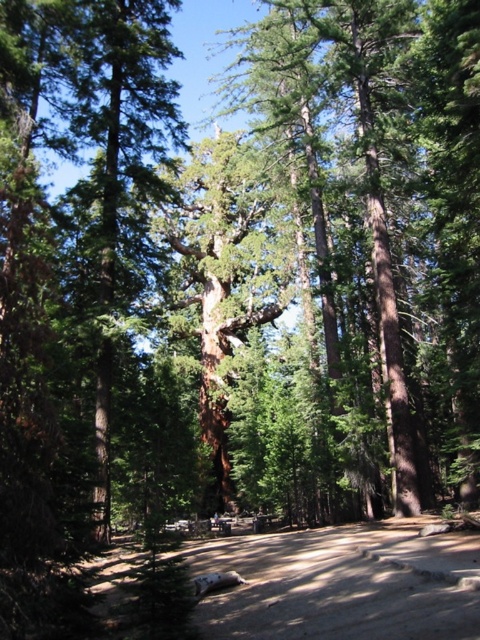
Question: Can you confirm if brown sandy dirt track at lower center is bigger than green rough bark tree at center?

Choices:
 (A) yes
 (B) no

Answer: (B)

Question: Does brown sandy dirt track at lower center appear under green rough bark tree at center?

Choices:
 (A) no
 (B) yes

Answer: (B)

Question: Which point appears closest to the camera in this image?

Choices:
 (A) pos(437,621)
 (B) pos(228,204)

Answer: (A)

Question: Which point is farther to the camera?

Choices:
 (A) (432, 570)
 (B) (223, 212)

Answer: (B)

Question: Observing the image, what is the correct spatial positioning of brown sandy dirt track at lower center in reference to green rough bark tree at center?

Choices:
 (A) left
 (B) right

Answer: (B)

Question: Which point is closer to the camera taking this photo?

Choices:
 (A) (220, 288)
 (B) (404, 614)

Answer: (B)